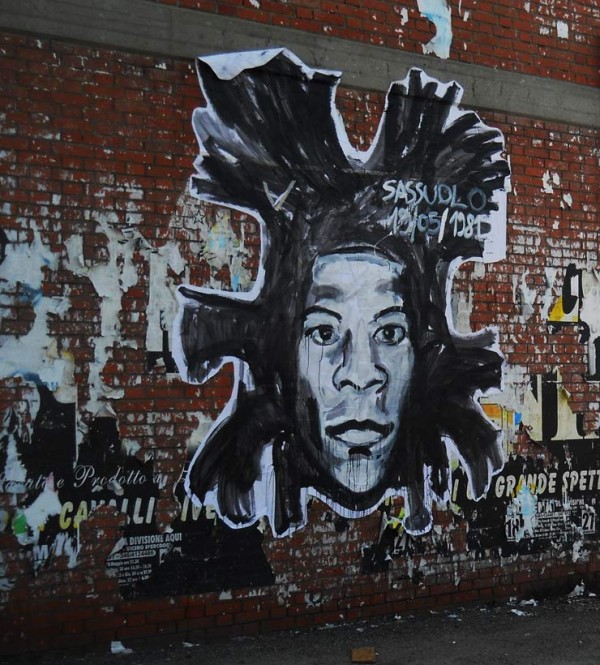
The image size is (600, 665). I want to click on brick wall, so click(x=337, y=559).